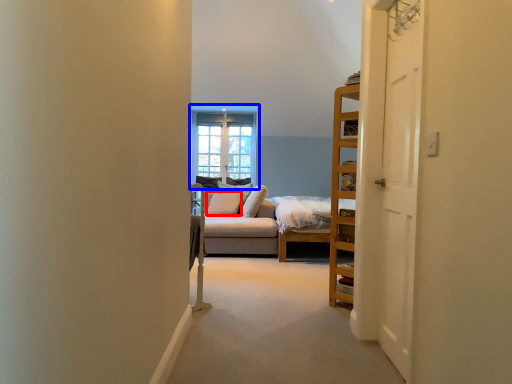
Question: Among these objects, which one is nearest to the camera, pillow (highlighted by a red box) or window (highlighted by a blue box)?

Choices:
 (A) pillow
 (B) window

Answer: (A)